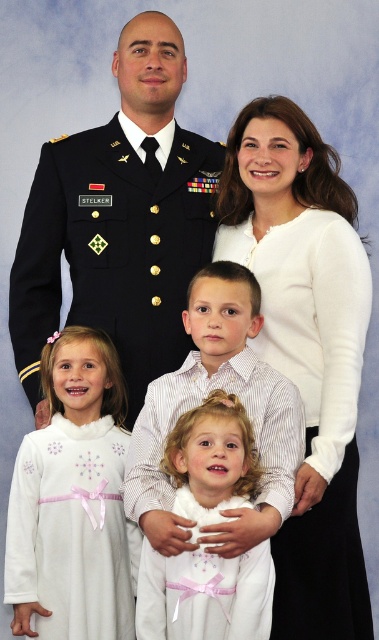
You are standing in front of the family portrait and want to touch the two points mentioned. Which point should you reach for first, the point at coordinates point [151,120] or the point at coordinates point [233,452]?

You should reach for the point at coordinates point [151,120] first because it is closer to you than the point at coordinates point [233,452], which is further away.